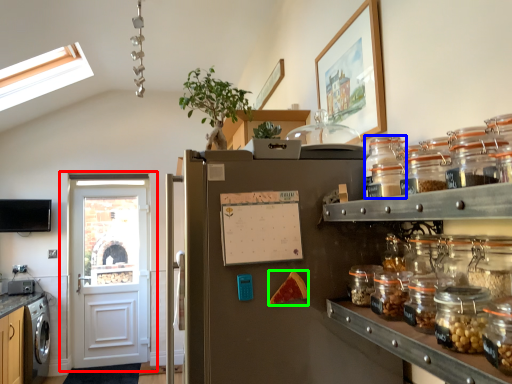
Question: Which is farther away from door (highlighted by a red box)? glass jar (highlighted by a blue box) or food (highlighted by a green box)?

Choices:
 (A) glass jar
 (B) food

Answer: (A)